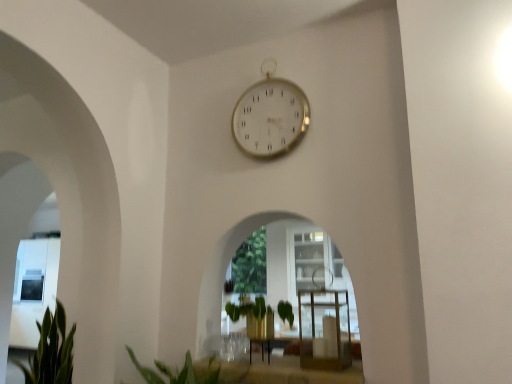
Question: Considering the relative sizes of green leafy plant at lower left and green leafy plant at center in the image provided, is green leafy plant at lower left thinner than green leafy plant at center?

Choices:
 (A) yes
 (B) no

Answer: (B)

Question: Is green leafy plant at lower left positioned in front of green leafy plant at center?

Choices:
 (A) yes
 (B) no

Answer: (A)

Question: Considering the relative sizes of green leafy plant at lower left and green leafy plant at center in the image provided, is green leafy plant at lower left taller than green leafy plant at center?

Choices:
 (A) yes
 (B) no

Answer: (B)

Question: Considering the relative positions of green leafy plant at lower left and green leafy plant at center in the image provided, is green leafy plant at lower left to the right of green leafy plant at center from the viewer's perspective?

Choices:
 (A) no
 (B) yes

Answer: (A)

Question: Is green leafy plant at lower left turned away from green leafy plant at center?

Choices:
 (A) yes
 (B) no

Answer: (A)

Question: Does green leafy plant at lower left have a greater width compared to green leafy plant at center?

Choices:
 (A) no
 (B) yes

Answer: (B)

Question: Is green leafy plant at lower left aimed at clear glass table at center?

Choices:
 (A) no
 (B) yes

Answer: (A)

Question: From a real-world perspective, is green leafy plant at lower left located beneath clear glass table at center?

Choices:
 (A) no
 (B) yes

Answer: (B)

Question: Considering the relative sizes of green leafy plant at lower left and clear glass table at center in the image provided, is green leafy plant at lower left wider than clear glass table at center?

Choices:
 (A) yes
 (B) no

Answer: (A)

Question: From a real-world perspective, is green leafy plant at lower left physically above clear glass table at center?

Choices:
 (A) yes
 (B) no

Answer: (B)

Question: Considering the relative sizes of green leafy plant at lower left and clear glass table at center in the image provided, is green leafy plant at lower left bigger than clear glass table at center?

Choices:
 (A) no
 (B) yes

Answer: (B)

Question: From the image's perspective, is green leafy plant at lower left on clear glass table at center?

Choices:
 (A) no
 (B) yes

Answer: (A)

Question: From the image's perspective, is gold metallic clock at upper center on clear glass table at center?

Choices:
 (A) yes
 (B) no

Answer: (A)